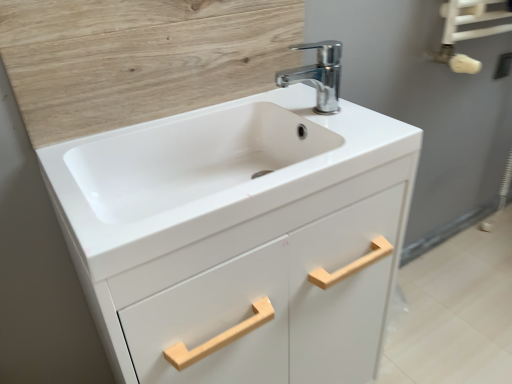
Image resolution: width=512 pixels, height=384 pixels. Identify the location of free space in front of white glossy towel rack at upper right. (466, 321).